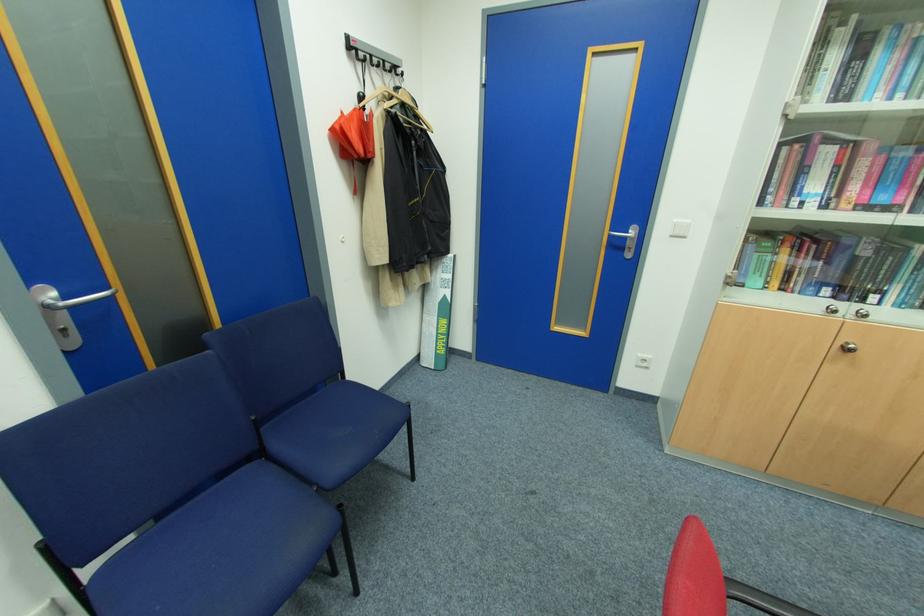
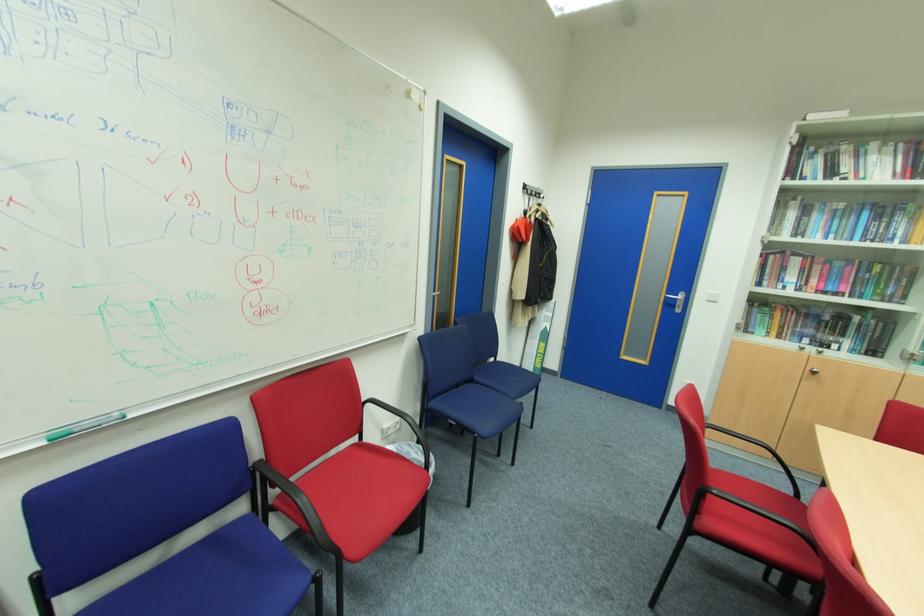
Which direction would the cameraman need to move to produce the second image?

The movement direction of the cameraman is left, backward.